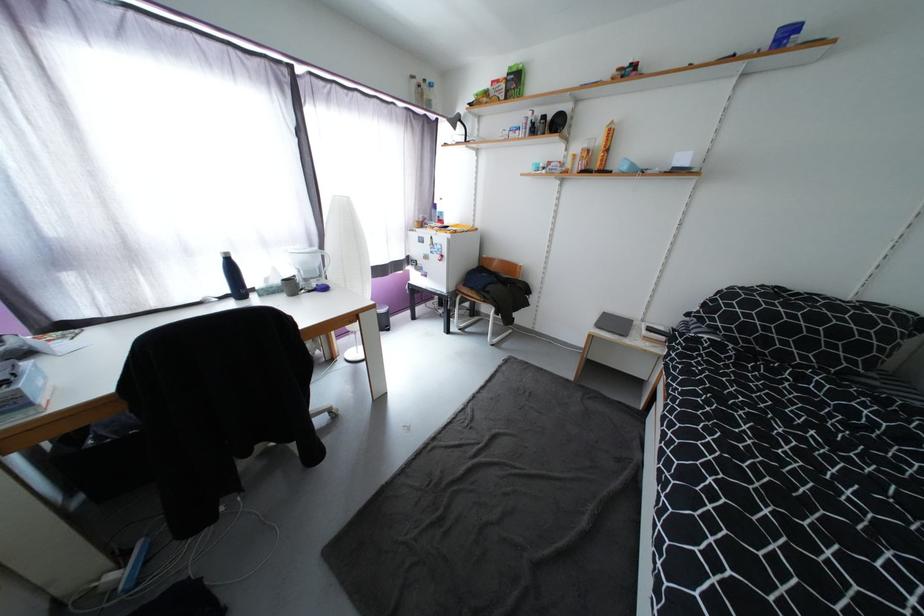
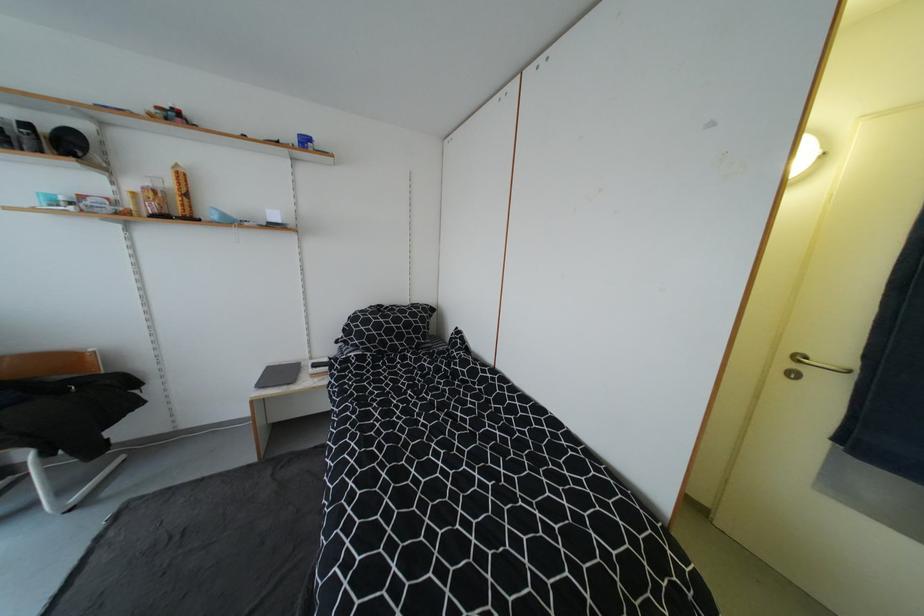
The point at (792, 37) is marked in the first image. Where is the corresponding point in the second image?

(311, 143)